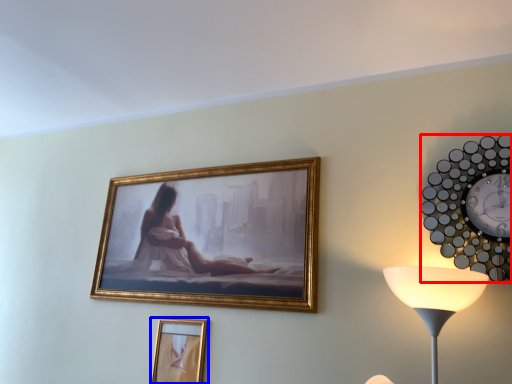
Question: Among these objects, which one is nearest to the camera, wall clock (highlighted by a red box) or picture frame (highlighted by a blue box)?

Choices:
 (A) wall clock
 (B) picture frame

Answer: (A)